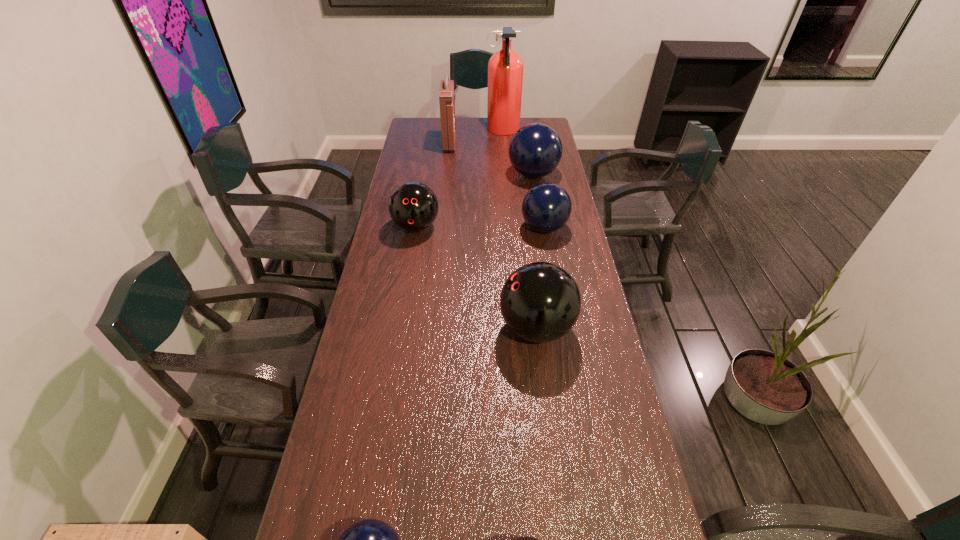
You are a GUI agent. You are given a task and a screenshot of the screen. Output one action in this format:
    pyautogui.click(x=<x>, y=<y>)
    Task: Click on the free space between the fire extinguisher and the red first-aid kit
    The width and height of the screenshot is (960, 540).
    Given the screenshot: What is the action you would take?
    pyautogui.click(x=476, y=138)

Where is `vacant region between the fire extinguisher and the second nearest blue bowling ball`? vacant region between the fire extinguisher and the second nearest blue bowling ball is located at coordinates (523, 179).

Where is `free spot between the leftmost black bowling ball and the biggest black bowling ball`? The image size is (960, 540). free spot between the leftmost black bowling ball and the biggest black bowling ball is located at coordinates tap(476, 278).

Locate an element on the screen. free spot between the fire extinguisher and the second tallest object is located at coordinates (476, 138).

Where is `object that stands as the third closest to the fire extinguisher`? This screenshot has height=540, width=960. object that stands as the third closest to the fire extinguisher is located at coordinates (546, 207).

The width and height of the screenshot is (960, 540). I want to click on object that is the third closest to the fourth farthest bowling ball, so click(522, 539).

Identify which bowling ball is the fifth nearest to the leftmost blue bowling ball. Please provide its 2D coordinates. Your answer should be formatted as a tuple, i.e. [(x, y)], where the tuple contains the x and y coordinates of a point satisfying the conditions above.

[(535, 150)]

I want to click on bowling ball identified as the third closest to the farthest bowling ball, so click(x=540, y=302).

In order to click on blue bowling ball object that ranks as the second closest to the nearest blue bowling ball in this screenshot , I will do `click(535, 150)`.

Identify which blue bowling ball is located as the third nearest to the tallest object. Please provide its 2D coordinates. Your answer should be formatted as a tuple, i.e. [(x, y)], where the tuple contains the x and y coordinates of a point satisfying the conditions above.

[(370, 539)]